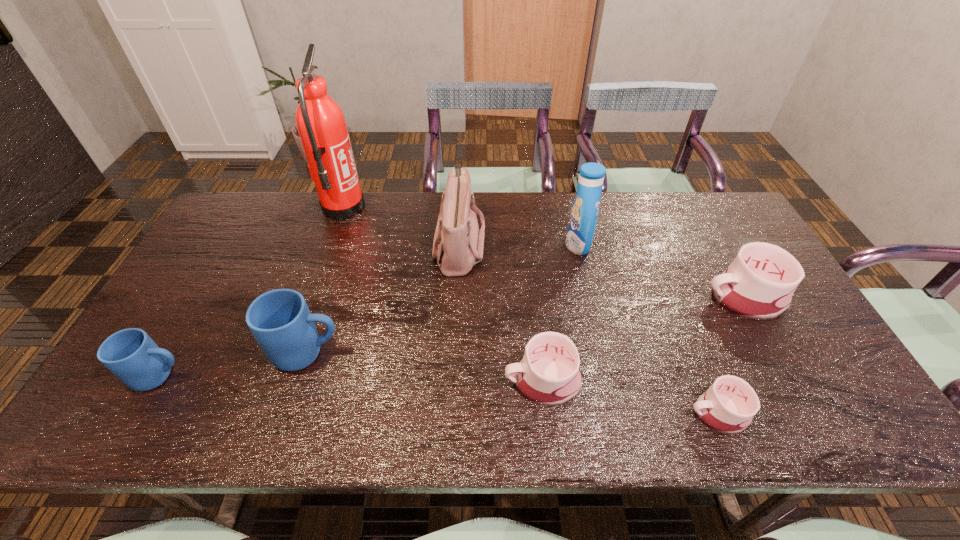
Locate an element on the screen. the tallest object is located at coordinates (321, 124).

Identify the location of detergent. coord(583,218).

In order to click on the seventh shortest object in this screenshot , I will do `click(583, 218)`.

Locate an element on the screen. The image size is (960, 540). shoulder bag is located at coordinates [458, 244].

What are the coordinates of `the bigger blue mug` in the screenshot? It's located at (280, 320).

Locate an element on the screen. the right blue mug is located at coordinates (280, 320).

Where is `the farthest mug`? This screenshot has height=540, width=960. the farthest mug is located at coordinates (759, 284).

In order to click on the biggest white mug in this screenshot , I will do `click(759, 284)`.

At what (x,y) coordinates should I click in order to perform the action: click on the left blue mug. Please return your answer as a coordinate pair (x, y). The image size is (960, 540). Looking at the image, I should click on (130, 354).

The image size is (960, 540). Identify the location of the leftmost mug. (130, 354).